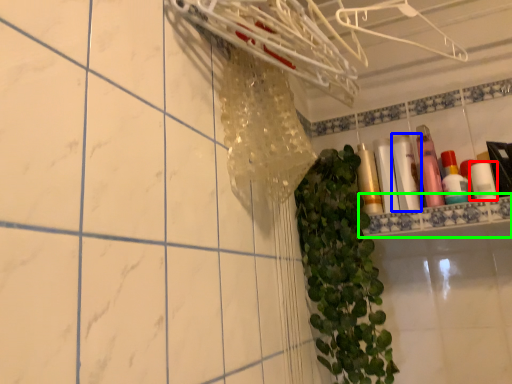
Question: Which object is the closest to the toiletry (highlighted by a red box)? Choose among these: toiletry (highlighted by a blue box) or ledge (highlighted by a green box).

Choices:
 (A) toiletry
 (B) ledge

Answer: (B)